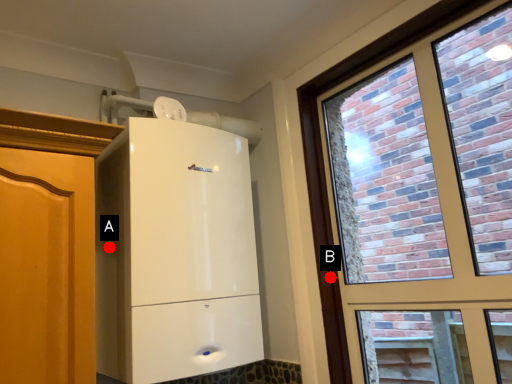
Question: Two points are circled on the image, labeled by A and B beside each circle. Among these points, which one is nearest to the camera?

Choices:
 (A) A is closer
 (B) B is closer

Answer: (A)